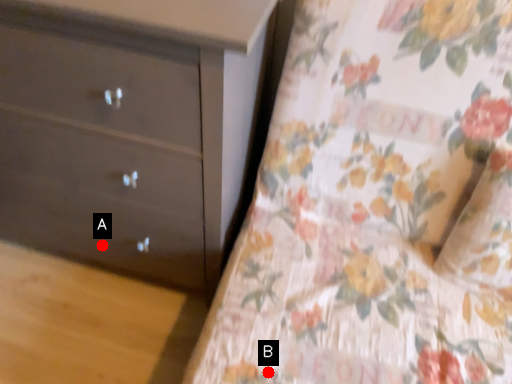
Question: Two points are circled on the image, labeled by A and B beside each circle. Which of the following is the farthest from the observer?

Choices:
 (A) A is further
 (B) B is further

Answer: (A)